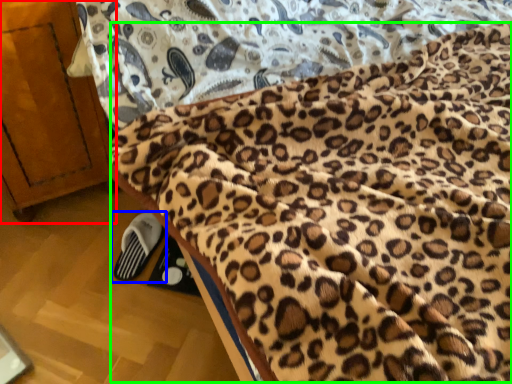
Question: Which object is positioned farthest from furniture (highlighted by a red box)? Select from footwear (highlighted by a blue box) and blanket (highlighted by a green box).

Choices:
 (A) footwear
 (B) blanket

Answer: (B)